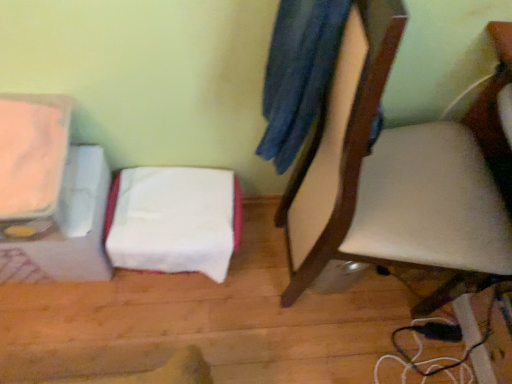
Find the location of a particular element. Image resolution: width=512 pixels, height=384 pixels. vacant area that lies between white leather chair at center and white fabric at lower left is located at coordinates (241, 277).